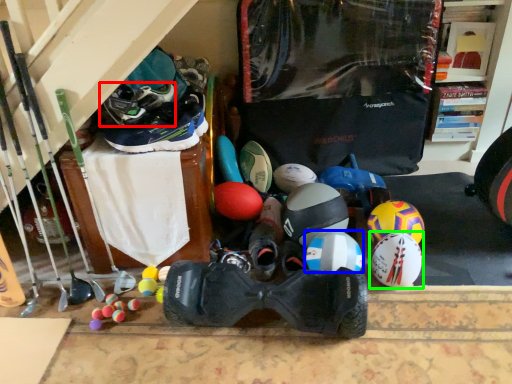
Question: Which is farther away from footwear (highlighted by a red box)? helmet (highlighted by a blue box) or helmet (highlighted by a green box)?

Choices:
 (A) helmet
 (B) helmet

Answer: (B)